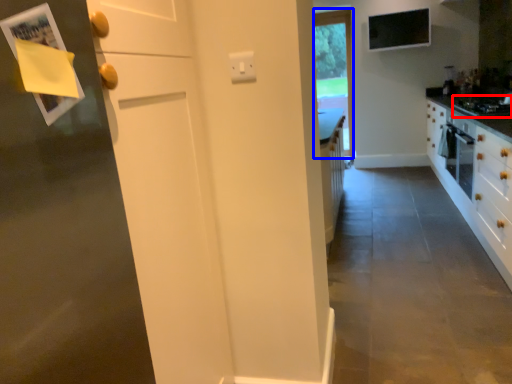
Question: Which object is further to the camera taking this photo, gas stove (highlighted by a red box) or window (highlighted by a blue box)?

Choices:
 (A) gas stove
 (B) window

Answer: (B)